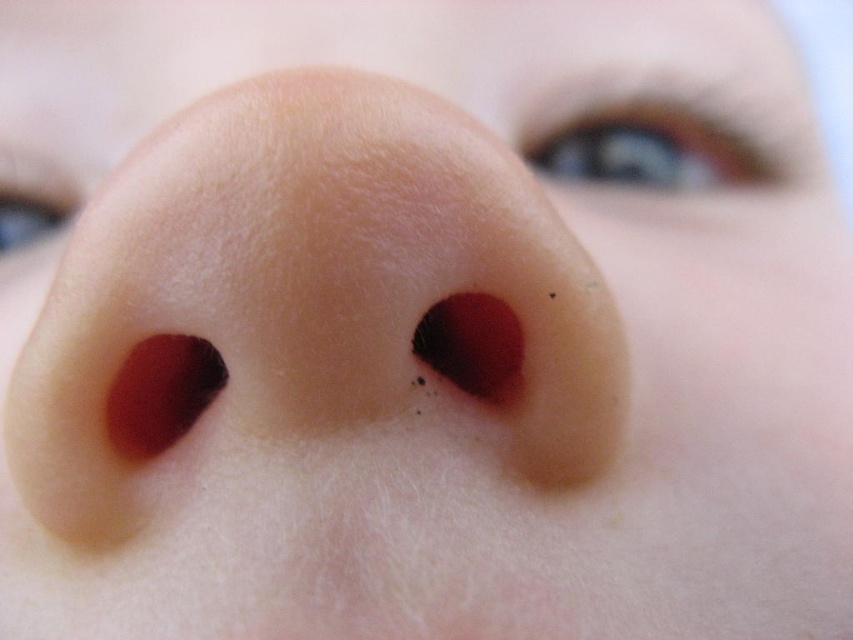
Question: Considering the relative positions of blue glossy eye at upper center and matte blue eye at upper left in the image provided, where is blue glossy eye at upper center located with respect to matte blue eye at upper left?

Choices:
 (A) below
 (B) above

Answer: (B)

Question: Among these objects, which one is farthest from the camera?

Choices:
 (A) blue glossy eye at upper center
 (B) matte blue eye at upper left

Answer: (A)

Question: Which object is farther from the camera taking this photo?

Choices:
 (A) blue glossy eye at upper center
 (B) matte blue eye at upper left

Answer: (A)

Question: Is blue glossy eye at upper center thinner than matte blue eye at upper left?

Choices:
 (A) yes
 (B) no

Answer: (B)

Question: Can you confirm if blue glossy eye at upper center is bigger than matte blue eye at upper left?

Choices:
 (A) yes
 (B) no

Answer: (A)